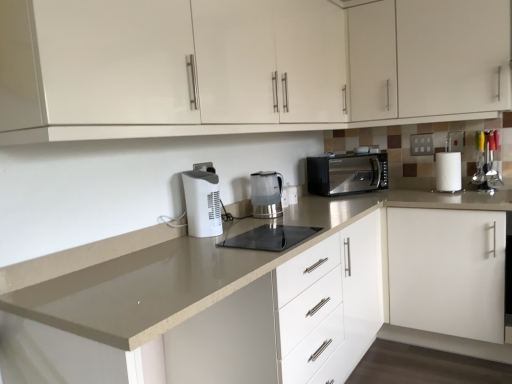
Question: Does beige laminate countertop at center come in front of white glossy cabinet at upper center, arranged as the 3th cabinetry when ordered from the bottom?

Choices:
 (A) no
 (B) yes

Answer: (B)

Question: From a real-world perspective, is beige laminate countertop at center under white glossy cabinet at upper center, which is the first cabinetry from top to bottom?

Choices:
 (A) yes
 (B) no

Answer: (A)

Question: Is beige laminate countertop at center facing away from white glossy cabinet at upper center, arranged as the 3th cabinetry when ordered from the bottom?

Choices:
 (A) no
 (B) yes

Answer: (A)

Question: Can you confirm if beige laminate countertop at center is taller than white glossy cabinet at upper center, arranged as the 3th cabinetry when ordered from the bottom?

Choices:
 (A) no
 (B) yes

Answer: (A)

Question: Is beige laminate countertop at center not inside white glossy cabinet at upper center, which is the first cabinetry from top to bottom?

Choices:
 (A) yes
 (B) no

Answer: (A)

Question: From a real-world perspective, is white matte cabinet at right, which ranks as the 1th cabinetry in bottom-to-top order, physically located above or below transparent plastic kettle at center, placed as the first home appliance when sorted from back to front?

Choices:
 (A) above
 (B) below

Answer: (B)

Question: In terms of height, does white matte cabinet at right, placed as the 3th cabinetry when sorted from top to bottom, look taller or shorter compared to transparent plastic kettle at center, placed as the first home appliance when sorted from back to front?

Choices:
 (A) tall
 (B) short

Answer: (A)

Question: From the image's perspective, is white matte cabinet at right, placed as the 3th cabinetry when sorted from top to bottom, above or below transparent plastic kettle at center, which is the first home appliance in right-to-left order?

Choices:
 (A) below
 (B) above

Answer: (A)

Question: Considering the positions of white matte cabinet at right, which ranks as the 1th cabinetry in bottom-to-top order, and transparent plastic kettle at center, acting as the second home appliance starting from the front, in the image, is white matte cabinet at right, which ranks as the 1th cabinetry in bottom-to-top order, wider or thinner than transparent plastic kettle at center, acting as the second home appliance starting from the front,?

Choices:
 (A) thin
 (B) wide

Answer: (B)

Question: Is point (377, 162) closer or farther from the camera than point (350, 294)?

Choices:
 (A) farther
 (B) closer

Answer: (A)

Question: In the image, is black metallic microwave at upper right positioned in front of or behind beige laminate countertop at center?

Choices:
 (A) front
 (B) behind

Answer: (B)

Question: Is black metallic microwave at upper right to the left or to the right of beige laminate countertop at center in the image?

Choices:
 (A) right
 (B) left

Answer: (A)

Question: From a real-world perspective, relative to beige laminate countertop at center, is black metallic microwave at upper right vertically above or below?

Choices:
 (A) above
 (B) below

Answer: (A)

Question: Is white glossy cabinet at upper center, which is counted as the 2th cabinetry, starting from the bottom, situated inside black glass cooktop at center or outside?

Choices:
 (A) inside
 (B) outside

Answer: (B)

Question: Would you say white glossy cabinet at upper center, which is counted as the 2th cabinetry, starting from the bottom, is to the left or to the right of black glass cooktop at center in the picture?

Choices:
 (A) right
 (B) left

Answer: (A)